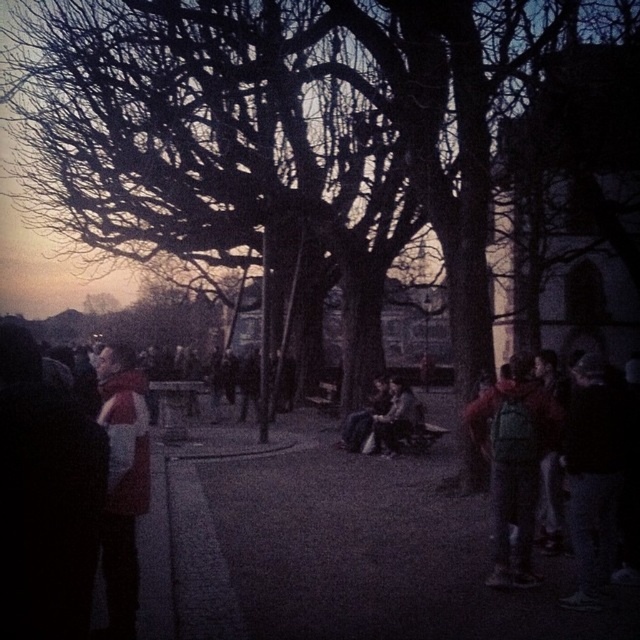
Question: Can you confirm if matte red scarf at left is smaller than dark brown leather jacket at center?

Choices:
 (A) no
 (B) yes

Answer: (A)

Question: Which point appears farthest from the camera in this image?

Choices:
 (A) (125, 436)
 (B) (387, 381)

Answer: (B)

Question: Estimate the real-world distances between objects in this image. Which object is closer to the red backpack at right?

Choices:
 (A) dark gray fabric jacket at center
 (B) dark brown leather jacket at center

Answer: (B)

Question: Considering the relative positions of bare branches at center and red backpack at right in the image provided, where is bare branches at center located with respect to red backpack at right?

Choices:
 (A) right
 (B) left

Answer: (B)

Question: Is dark brown leather jacket at center bigger than dark gray fabric jacket at center?

Choices:
 (A) no
 (B) yes

Answer: (A)

Question: Among these objects, which one is farthest from the camera?

Choices:
 (A) dark gray fabric jacket at center
 (B) dark brown leather jacket at center

Answer: (A)